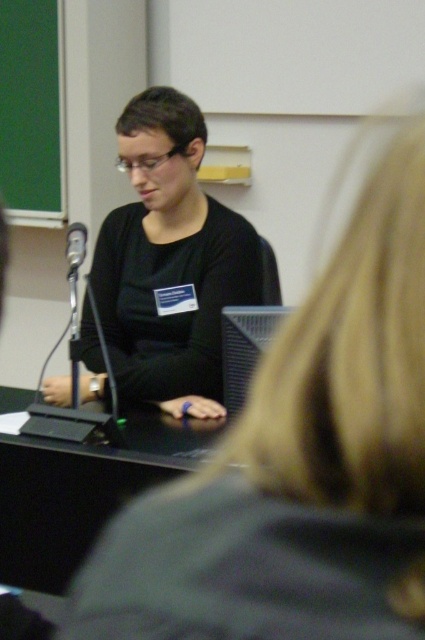
Question: Which point is farther from the camera taking this photo?

Choices:
 (A) (73, 243)
 (B) (61, 192)
 (C) (127, 120)

Answer: (B)

Question: Can you confirm if green chalkboard at upper left is positioned to the left of black plastic microphone at left?

Choices:
 (A) yes
 (B) no

Answer: (A)

Question: Which point is farther to the camera?

Choices:
 (A) black plastic microphone at left
 (B) green chalkboard at upper left
 (C) black matte shirt at center

Answer: (B)

Question: In this image, where is black matte shirt at center located relative to black plastic microphone at left?

Choices:
 (A) above
 (B) below

Answer: (A)

Question: Does black matte shirt at center appear over green chalkboard at upper left?

Choices:
 (A) no
 (B) yes

Answer: (A)

Question: Among these points, which one is nearest to the camera?

Choices:
 (A) (192, 280)
 (B) (17, 202)

Answer: (A)